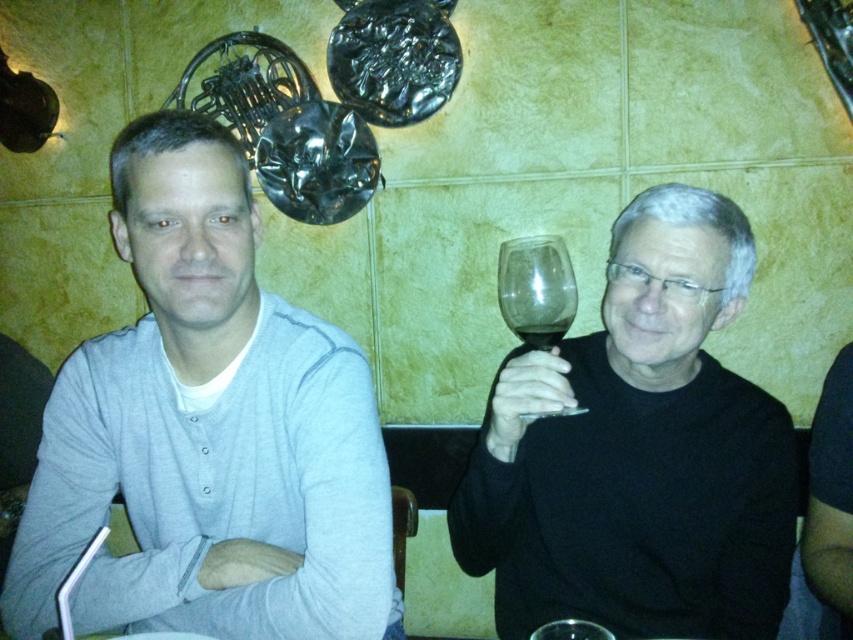
Question: Which point is farther to the camera?

Choices:
 (A) transparent glass wine at upper center
 (B) black matte wine glass at right
 (C) gray cotton shirt at left

Answer: (A)

Question: Which of the following is the closest to the observer?

Choices:
 (A) (523, 339)
 (B) (521, 257)

Answer: (A)

Question: Which point is closer to the camera?

Choices:
 (A) (747, 474)
 (B) (543, 340)
 (C) (328, 346)

Answer: (B)

Question: Is the position of transparent glass at right less distant than that of transparent glass wine at upper center?

Choices:
 (A) yes
 (B) no

Answer: (A)

Question: Does gray cotton shirt at left come behind transparent glass wine at upper center?

Choices:
 (A) yes
 (B) no

Answer: (B)

Question: Is black matte wine glass at right wider than transparent glass wine at upper center?

Choices:
 (A) yes
 (B) no

Answer: (A)